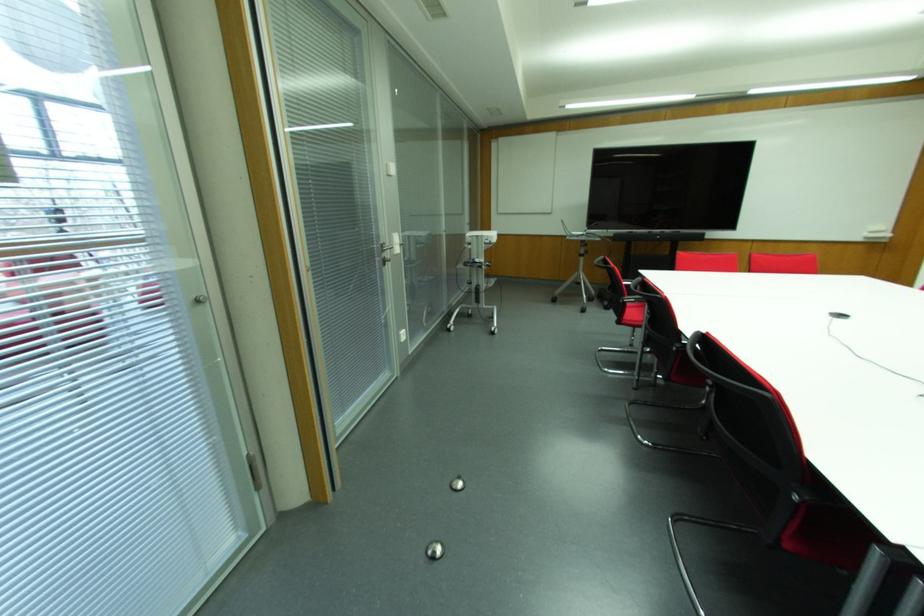
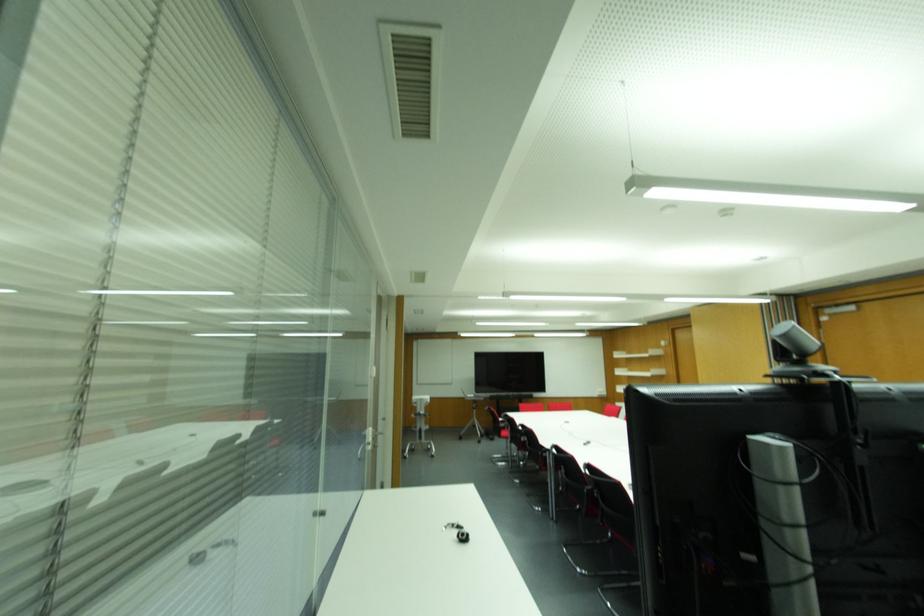
Where in the second image is the point corresponding to [636,326] from the first image?

(505, 438)